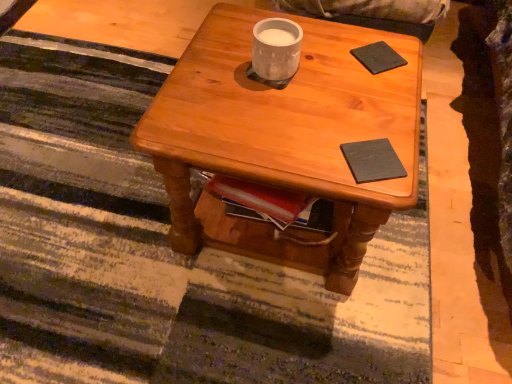
Where is `free area in between black matte pad at upper right, the second pad in the front-to-back sequence, and dark matte book at center, which is the first pad from front to back`? free area in between black matte pad at upper right, the second pad in the front-to-back sequence, and dark matte book at center, which is the first pad from front to back is located at coordinates (379, 105).